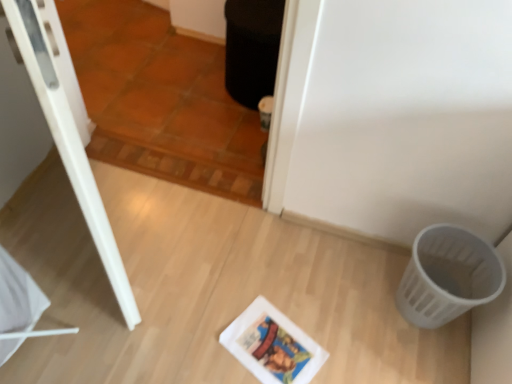
Where is `vacant space to the right of matte white comic book at center`? vacant space to the right of matte white comic book at center is located at coordinates (343, 339).